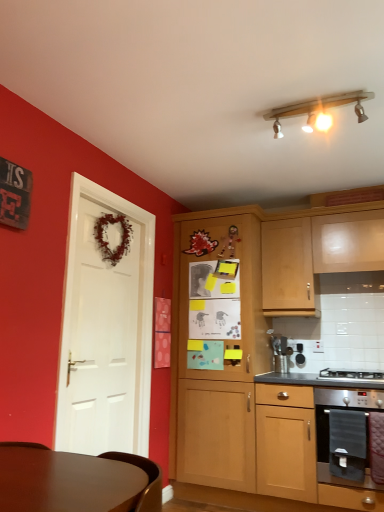
Question: Considering the relative sizes of stainless steel oven at lower right, which is the second cabinetry in left-to-right order, and wooden track light at upper center in the image provided, is stainless steel oven at lower right, which is the second cabinetry in left-to-right order, thinner than wooden track light at upper center?

Choices:
 (A) yes
 (B) no

Answer: (B)

Question: Is stainless steel oven at lower right, arranged as the second cabinetry when viewed from the right, turned away from wooden track light at upper center?

Choices:
 (A) yes
 (B) no

Answer: (B)

Question: Is stainless steel oven at lower right, which is the second cabinetry in left-to-right order, shorter than wooden track light at upper center?

Choices:
 (A) yes
 (B) no

Answer: (B)

Question: Is stainless steel oven at lower right, which is the second cabinetry in left-to-right order, wider than wooden track light at upper center?

Choices:
 (A) no
 (B) yes

Answer: (B)

Question: Considering the relative positions of stainless steel oven at lower right, arranged as the second cabinetry when viewed from the right, and wooden track light at upper center in the image provided, is stainless steel oven at lower right, arranged as the second cabinetry when viewed from the right, to the left of wooden track light at upper center from the viewer's perspective?

Choices:
 (A) no
 (B) yes

Answer: (A)

Question: From a real-world perspective, is stainless steel oven at lower right, arranged as the second cabinetry when viewed from the right, below wooden track light at upper center?

Choices:
 (A) yes
 (B) no

Answer: (A)

Question: Is white matte door at left surrounded by stainless steel oven at lower right, arranged as the second cabinetry when viewed from the right?

Choices:
 (A) yes
 (B) no

Answer: (B)

Question: Is stainless steel oven at lower right, arranged as the second cabinetry when viewed from the right, facing away from white matte door at left?

Choices:
 (A) no
 (B) yes

Answer: (A)

Question: Does stainless steel oven at lower right, arranged as the second cabinetry when viewed from the right, have a larger size compared to white matte door at left?

Choices:
 (A) no
 (B) yes

Answer: (B)

Question: Is stainless steel oven at lower right, arranged as the second cabinetry when viewed from the right, thinner than white matte door at left?

Choices:
 (A) no
 (B) yes

Answer: (A)

Question: Does stainless steel oven at lower right, which is the second cabinetry in left-to-right order, come in front of white matte door at left?

Choices:
 (A) no
 (B) yes

Answer: (A)

Question: Is the depth of stainless steel oven at lower right, which is the second cabinetry in left-to-right order, greater than that of white matte door at left?

Choices:
 (A) yes
 (B) no

Answer: (A)

Question: Considering the relative sizes of wooden cabinet at center, the 1th cabinetry viewed from the left, and stainless steel oven at lower right, arranged as the second cabinetry when viewed from the right, in the image provided, is wooden cabinet at center, the 1th cabinetry viewed from the left, thinner than stainless steel oven at lower right, arranged as the second cabinetry when viewed from the right,?

Choices:
 (A) no
 (B) yes

Answer: (B)